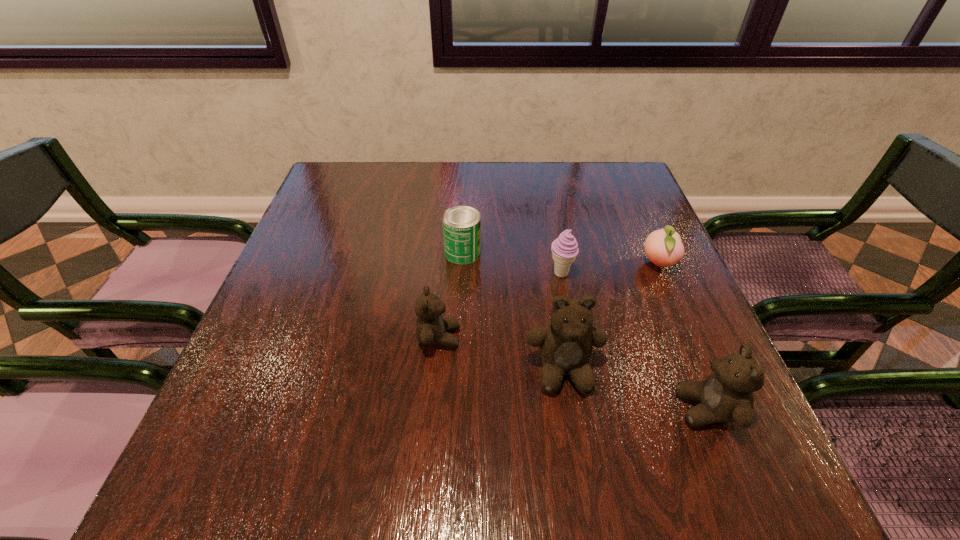
Identify the location of the shortest teddy bear. (431, 328).

This screenshot has height=540, width=960. In order to click on the second teddy bear from left to right in this screenshot , I will do `click(565, 343)`.

Identify the location of the second tallest teddy bear. This screenshot has width=960, height=540. (726, 395).

Locate an element on the screen. the fifth shortest object is located at coordinates (726, 395).

Locate an element on the screen. Image resolution: width=960 pixels, height=540 pixels. peach is located at coordinates (663, 247).

The image size is (960, 540). What are the coordinates of `icecream` in the screenshot? It's located at (564, 249).

Locate an element on the screen. This screenshot has height=540, width=960. can is located at coordinates (461, 224).

Identify the location of vacant space located 0.400m on the face of the shortest teddy bear. (661, 338).

Locate an element on the screen. The height and width of the screenshot is (540, 960). vacant space located on the face of the second teddy bear from left to right is located at coordinates point(572,425).

The image size is (960, 540). I want to click on free space located on the face of the rightmost teddy bear, so click(x=539, y=409).